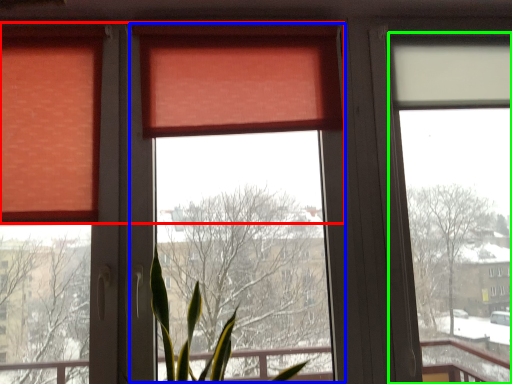
Question: Which object is the farthest from curtain (highlighted by a red box)? Choose among these: window screen (highlighted by a blue box) or window screen (highlighted by a green box).

Choices:
 (A) window screen
 (B) window screen

Answer: (B)